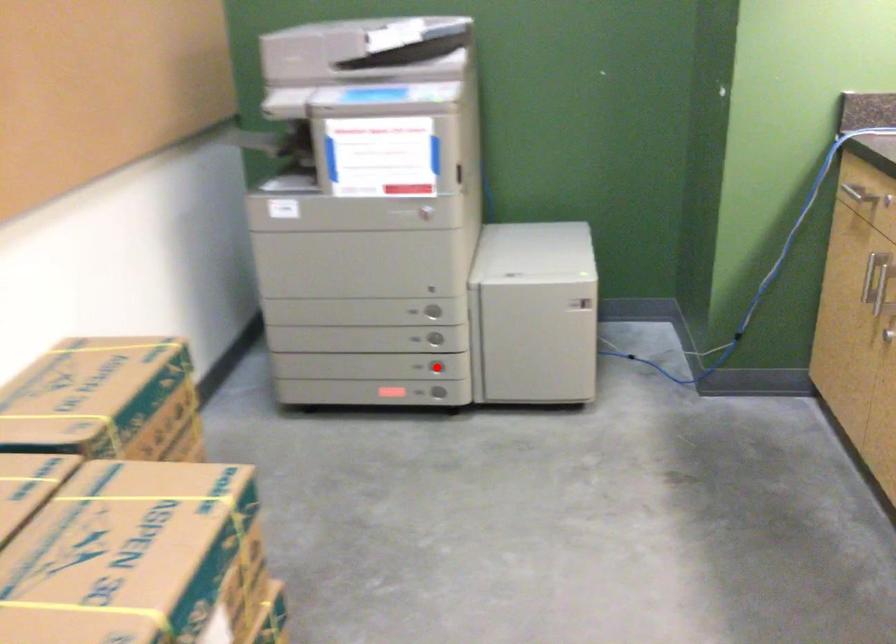
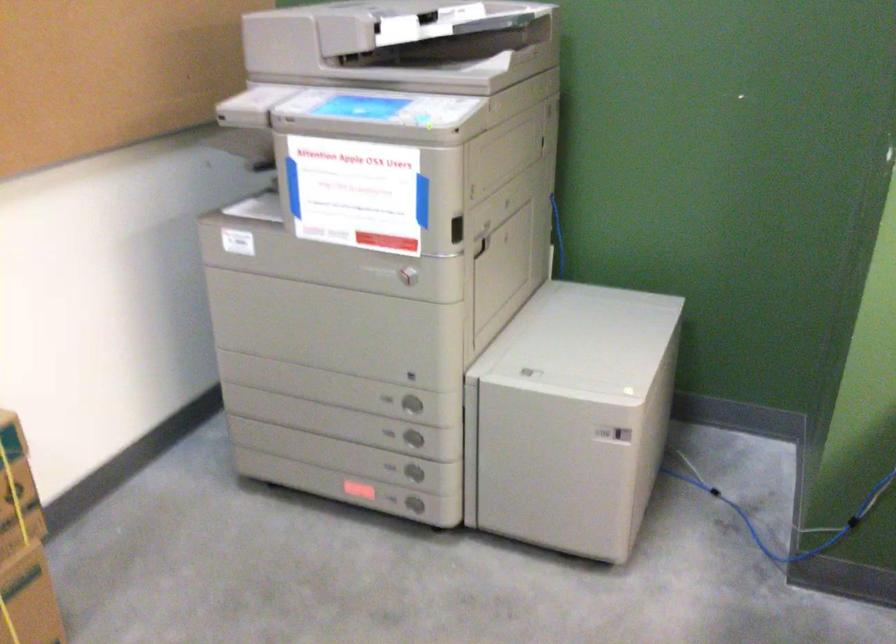
In the second image, find the point that corresponds to the highlighted location in the first image.

(412, 471)